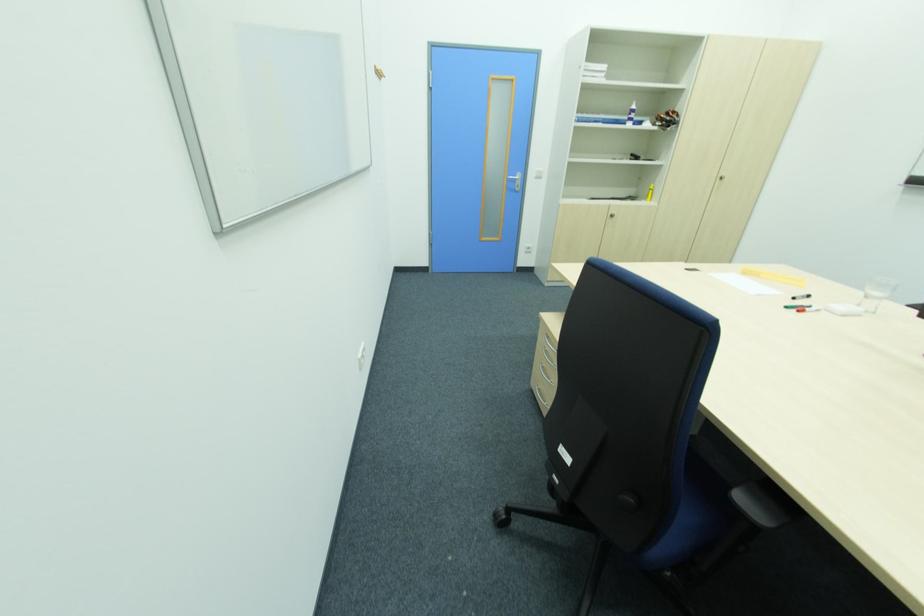
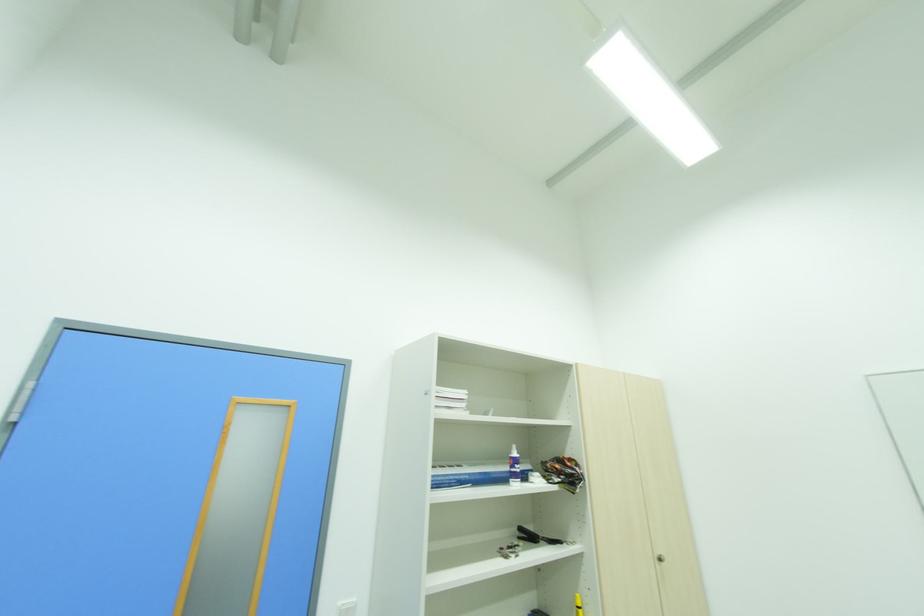
Locate, in the second image, the point that corresponds to point 637,116 in the first image.

(520, 469)